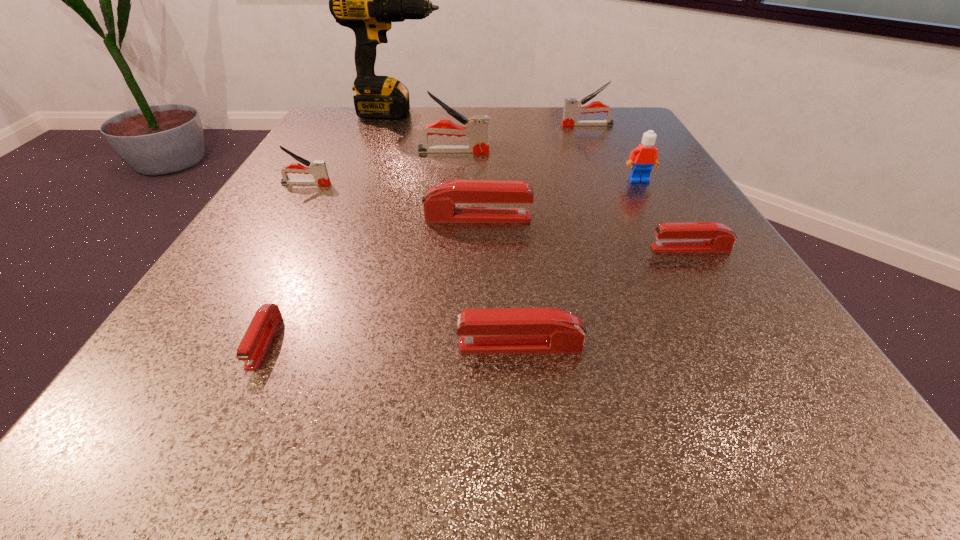
Find the location of a particular element. The image size is (960, 540). drill is located at coordinates (366, 0).

This screenshot has width=960, height=540. Find the location of `the tallest object`. the tallest object is located at coordinates (366, 0).

Identify the location of the third farthest object. (477, 128).

Image resolution: width=960 pixels, height=540 pixels. I want to click on the second farthest stapler, so click(477, 128).

You are a GUI agent. You are given a task and a screenshot of the screen. Output one action in this format:
    pyautogui.click(x=<x>, y=<y>)
    Task: Click on the second farthest object
    This screenshot has height=540, width=960.
    Given the screenshot: What is the action you would take?
    pyautogui.click(x=572, y=107)

Locate an element on the screen. the second smallest gray stapler is located at coordinates (572, 107).

Where is `Lego`? Lego is located at coordinates coord(642,158).

The height and width of the screenshot is (540, 960). I want to click on the leftmost stapler, so click(x=318, y=168).

The width and height of the screenshot is (960, 540). I want to click on the leftmost gray stapler, so click(x=318, y=168).

The height and width of the screenshot is (540, 960). In order to click on the fourth nearest object in this screenshot , I will do `click(439, 203)`.